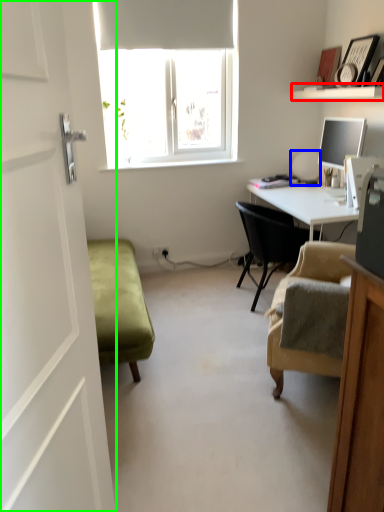
Question: Estimate the real-world distances between objects in this image. Which object is closer to shelf (highlighted by a red box), table lamp (highlighted by a blue box) or screen door (highlighted by a green box)?

Choices:
 (A) table lamp
 (B) screen door

Answer: (A)